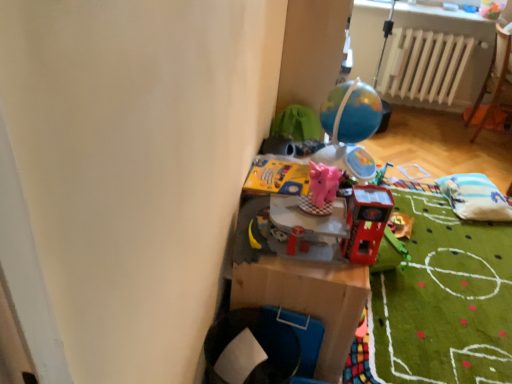
Identify the location of vacant region below yellow cardboard book at center, positioned as the 2th toy in back-to-front order (from a real-world perspective). (277, 177).